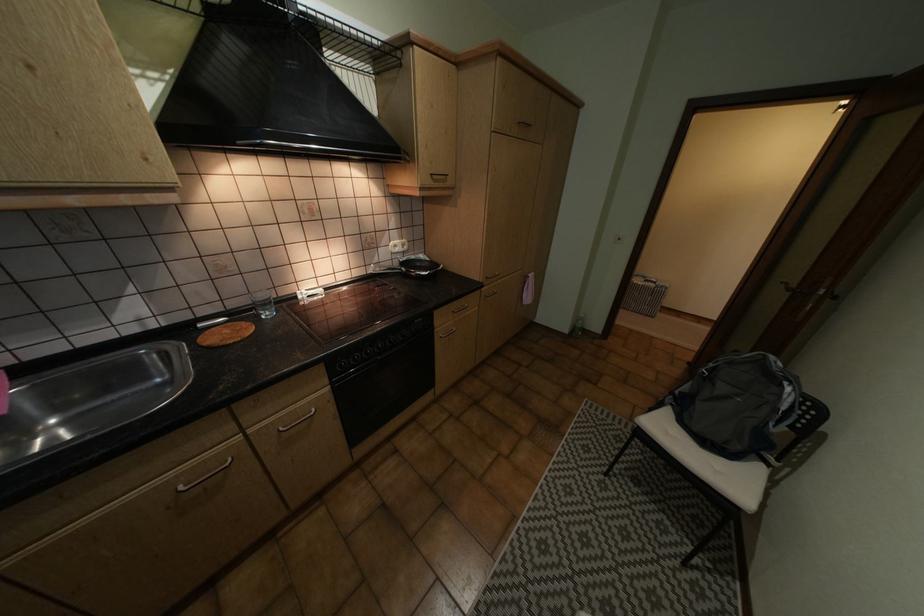
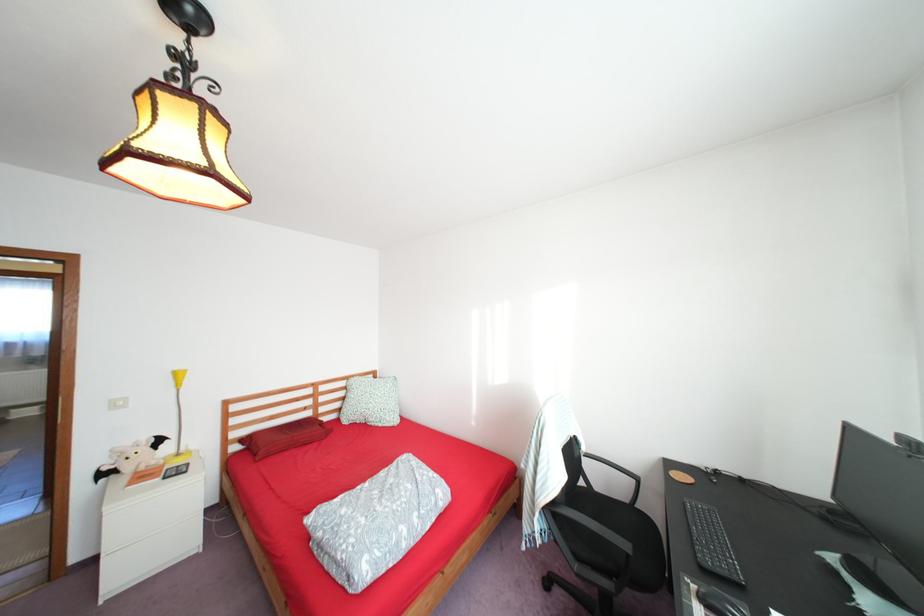
Question: I am providing you with two images of the same scene from different viewpoints. After the viewpoint changes to image2, which objects are now occluded?

Choices:
 (A) folded patterned blanket
 (B) bat plush toy
 (C) patterned bolster pillow
 (D) black oven knob

Answer: (D)